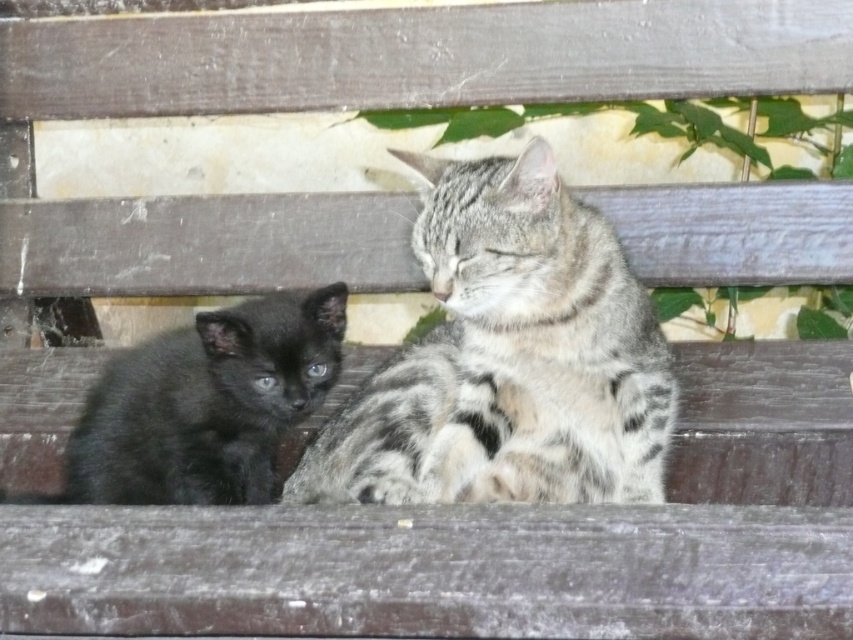
Question: Can you confirm if gray striped cat at center is positioned below black fur kitten at left?

Choices:
 (A) no
 (B) yes

Answer: (B)

Question: Does gray striped cat at center appear under black fur kitten at left?

Choices:
 (A) no
 (B) yes

Answer: (B)

Question: In this image, where is gray striped cat at center located relative to black fur kitten at left?

Choices:
 (A) left
 (B) right

Answer: (B)

Question: Which point is closer to the camera?

Choices:
 (A) (396, 413)
 (B) (125, 385)

Answer: (B)